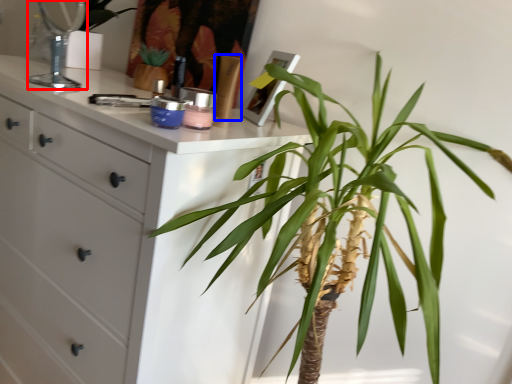
Question: Which object is closer to the camera taking this photo, mirror (highlighted by a red box) or toiletry (highlighted by a blue box)?

Choices:
 (A) mirror
 (B) toiletry

Answer: (B)